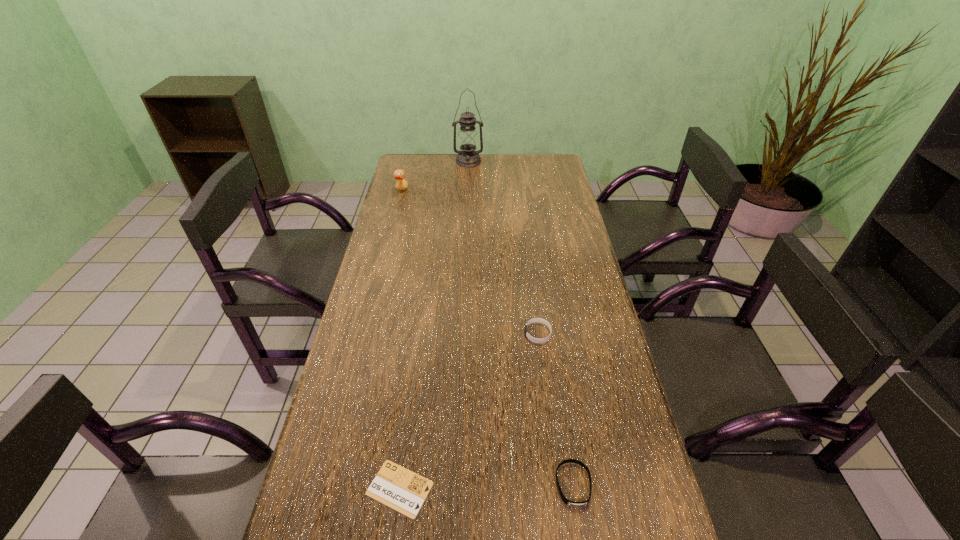
At what (x,y) coordinates should I click in order to perform the action: click on free space located on the beak of the second farthest object. Please return your answer as a coordinate pair (x, y). Image resolution: width=960 pixels, height=540 pixels. Looking at the image, I should click on tap(420, 191).

You are a GUI agent. You are given a task and a screenshot of the screen. Output one action in this format:
    pyautogui.click(x=<x>, y=<y>)
    Task: Click on the vacant space located on the outer surface of the taller wristband
    This screenshot has width=960, height=540.
    Given the screenshot: What is the action you would take?
    pyautogui.click(x=490, y=334)

This screenshot has width=960, height=540. I want to click on free spot located 0.050m on the outer surface of the taller wristband, so click(507, 334).

Find the location of a particular element. This screenshot has height=540, width=960. vacant space located on the outer surface of the taller wristband is located at coordinates (444, 334).

I want to click on free space located 0.220m on the right of the identity card, so click(537, 489).

Identify the location of object at the far edge. coord(468,140).

The width and height of the screenshot is (960, 540). What are the coordinates of `duck present at the left edge` in the screenshot? It's located at (399, 175).

Identify the location of identity card that is positioned at the left edge. (395, 486).

Where is `object that is positioned at the right edge`? object that is positioned at the right edge is located at coordinates (570, 503).

At what (x,y) coordinates should I click in order to perform the action: click on free space at the far edge of the desktop. Please return your answer as a coordinate pair (x, y). The height and width of the screenshot is (540, 960). Looking at the image, I should click on (496, 179).